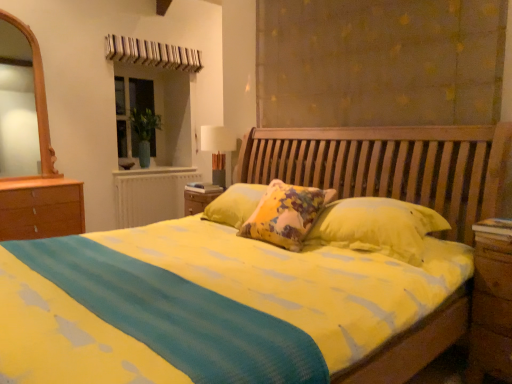
Question: From a real-world perspective, is green glass vase at upper left located beneath matte brown curtain at upper center?

Choices:
 (A) no
 (B) yes

Answer: (B)

Question: Is green glass vase at upper left next to matte brown curtain at upper center and touching it?

Choices:
 (A) no
 (B) yes

Answer: (A)

Question: Considering the relative sizes of green glass vase at upper left and matte brown curtain at upper center in the image provided, is green glass vase at upper left taller than matte brown curtain at upper center?

Choices:
 (A) yes
 (B) no

Answer: (A)

Question: From a real-world perspective, is green glass vase at upper left on top of matte brown curtain at upper center?

Choices:
 (A) no
 (B) yes

Answer: (A)

Question: Does green glass vase at upper left have a larger size compared to matte brown curtain at upper center?

Choices:
 (A) no
 (B) yes

Answer: (A)

Question: Is matte brown curtain at upper center wider or thinner than white fabric lampshade at upper center?

Choices:
 (A) wide
 (B) thin

Answer: (B)

Question: From their relative heights in the image, would you say matte brown curtain at upper center is taller or shorter than white fabric lampshade at upper center?

Choices:
 (A) short
 (B) tall

Answer: (B)

Question: Would you say matte brown curtain at upper center is inside or outside white fabric lampshade at upper center?

Choices:
 (A) outside
 (B) inside

Answer: (A)

Question: Considering the positions of matte brown curtain at upper center and white fabric lampshade at upper center in the image, is matte brown curtain at upper center bigger or smaller than white fabric lampshade at upper center?

Choices:
 (A) small
 (B) big

Answer: (B)

Question: Is white fabric lampshade at upper center taller or shorter than green glass vase at upper left?

Choices:
 (A) tall
 (B) short

Answer: (B)

Question: From the image's perspective, relative to green glass vase at upper left, is white fabric lampshade at upper center above or below?

Choices:
 (A) below
 (B) above

Answer: (A)

Question: In terms of width, does white fabric lampshade at upper center look wider or thinner when compared to green glass vase at upper left?

Choices:
 (A) thin
 (B) wide

Answer: (B)

Question: Considering the relative positions of white fabric lampshade at upper center and green glass vase at upper left in the image provided, is white fabric lampshade at upper center to the left or to the right of green glass vase at upper left?

Choices:
 (A) right
 (B) left

Answer: (A)

Question: From a real-world perspective, relative to brown wooden nightstand at right, is white fabric lampshade at upper center vertically above or below?

Choices:
 (A) below
 (B) above

Answer: (B)

Question: Is white fabric lampshade at upper center in front of or behind brown wooden nightstand at right in the image?

Choices:
 (A) behind
 (B) front

Answer: (A)